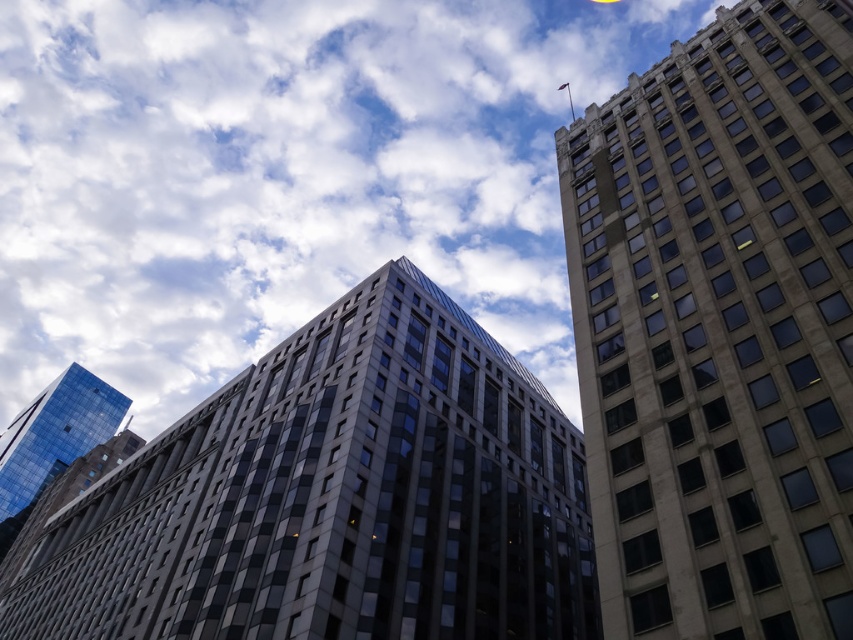
Question: Considering the real-world distances, which object is closest to the matte glass building at center?

Choices:
 (A) shiny glass skyscraper at lower left
 (B) white fluffy cloud at upper center
 (C) beige stone tower at right

Answer: (C)

Question: Does white fluffy cloud at upper center appear on the left side of matte glass building at center?

Choices:
 (A) no
 (B) yes

Answer: (B)

Question: Is matte glass building at center wider than shiny glass skyscraper at lower left?

Choices:
 (A) no
 (B) yes

Answer: (B)

Question: Which point is closer to the camera taking this photo?

Choices:
 (A) (80, 410)
 (B) (94, 68)
 (C) (480, 508)
 (D) (717, 29)

Answer: (D)

Question: Can you confirm if white fluffy cloud at upper center is positioned above matte glass building at center?

Choices:
 (A) yes
 (B) no

Answer: (A)

Question: Which point appears closest to the camera in this image?

Choices:
 (A) (142, 632)
 (B) (608, 596)
 (C) (289, 312)

Answer: (B)